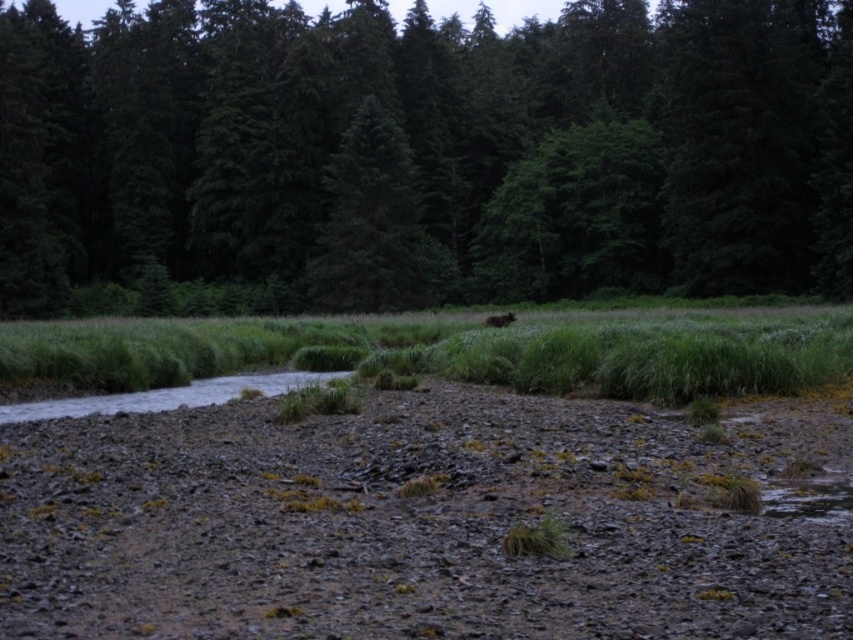
Who is more forward, (722,355) or (508,321)?

Point (722,355) is in front.

Does point (311, 355) come closer to viewer compared to point (514, 316)?

Yes, point (311, 355) is in front of point (514, 316).

Where is `green grass at center`? This screenshot has width=853, height=640. green grass at center is located at coordinates (447, 349).

The width and height of the screenshot is (853, 640). What do you see at coordinates (426, 150) in the screenshot?
I see `green matte tree at upper center` at bounding box center [426, 150].

Is the position of green matte tree at upper center less distant than that of brown furry bear at center?

That is False.

Is point (413, 221) behind point (514, 317)?

Yes.

I want to click on green matte tree at upper center, so click(x=426, y=150).

Is green matte tree at upper center to the right of green matte tree at center from the viewer's perspective?

Yes, green matte tree at upper center is to the right of green matte tree at center.

At what (x,y) coordinates should I click in order to perform the action: click on green matte tree at upper center. Please return your answer as a coordinate pair (x, y). Image resolution: width=853 pixels, height=640 pixels. Looking at the image, I should click on (426, 150).

Is point (442, 29) positioned before point (311, 300)?

No.

The width and height of the screenshot is (853, 640). Find the location of `green matte tree at upper center`. green matte tree at upper center is located at coordinates (426, 150).